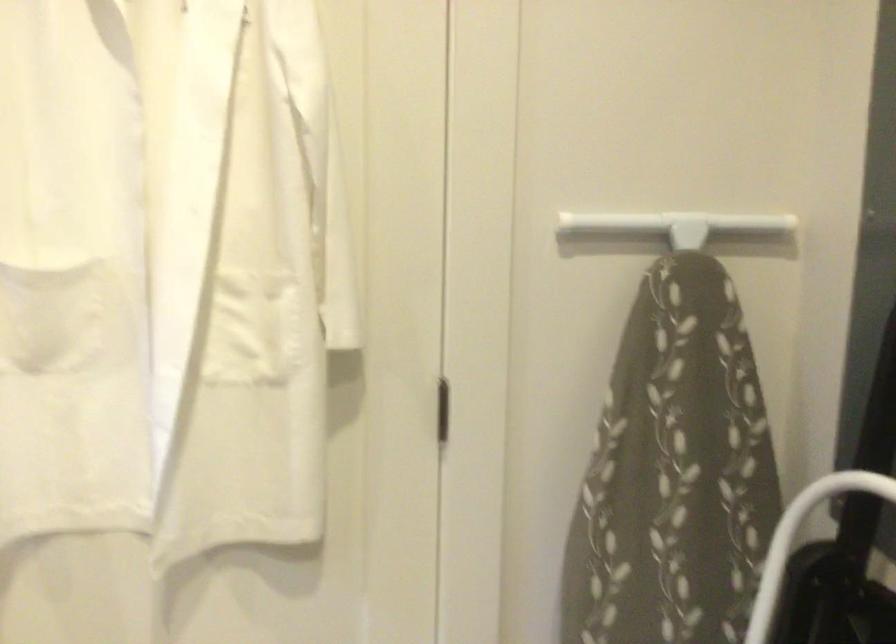
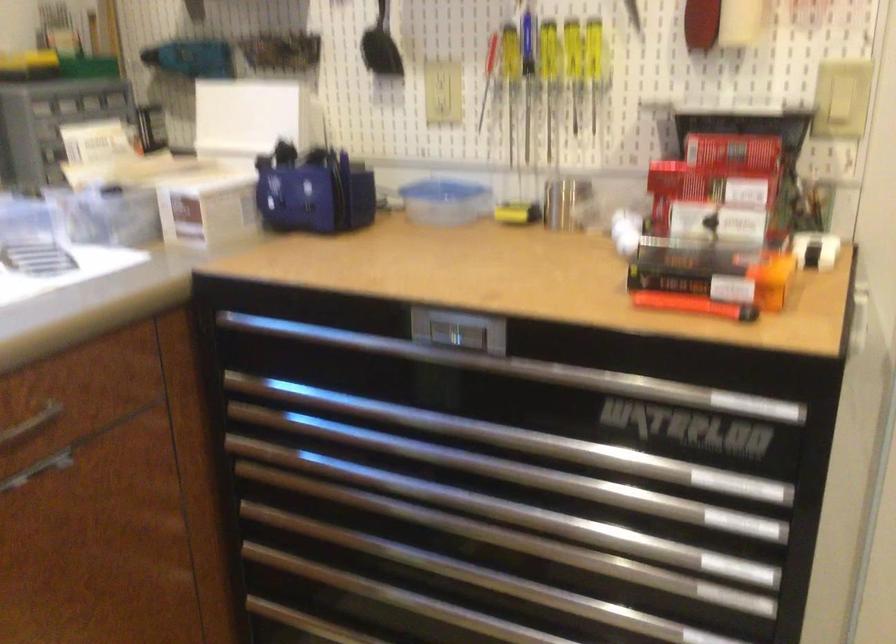
Question: The first image is from the beginning of the video and the second image is from the end. How did the camera likely rotate when shooting the video?

Choices:
 (A) Left
 (B) Right
 (C) Up
 (D) Down

Answer: (A)